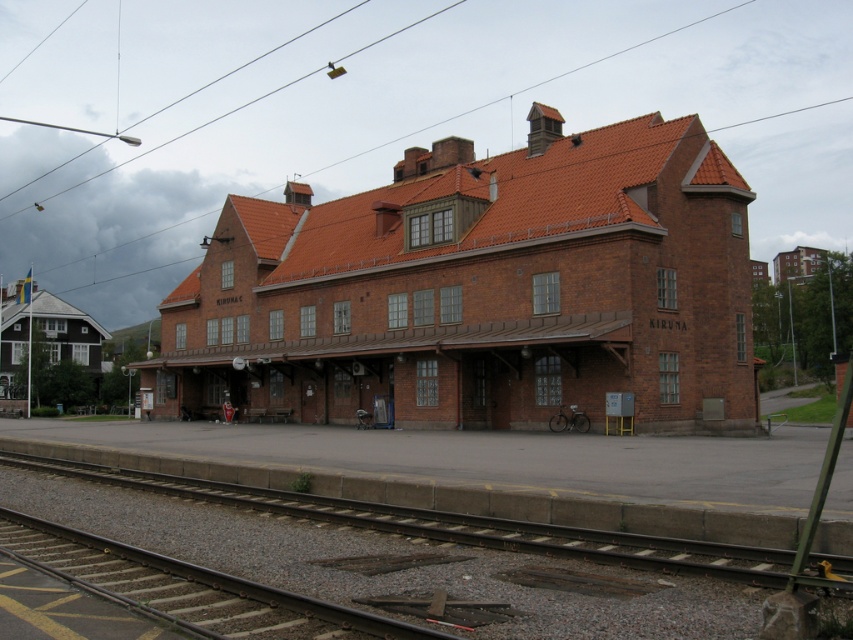
You are standing at the entrance of the KIRUNA train station and want to find the smooth metal tracks at center. According to the 2D coordinates provided, where should you look to find them?

The smooth metal tracks at center are located at the 2D coordinates point (397, 547).

You are standing at the entrance of the train station platform. You want to locate the brick building at center. In which direction should you look relative to your current position?

The brick building at center is located at point coordinates of (480,289), so you should look towards the center area of the platform where the coordinates are.